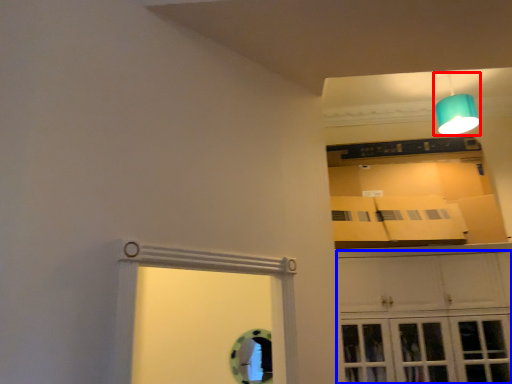
Question: Which point is further to the camera, lamp (highlighted by a red box) or cabinetry (highlighted by a blue box)?

Choices:
 (A) lamp
 (B) cabinetry

Answer: (A)